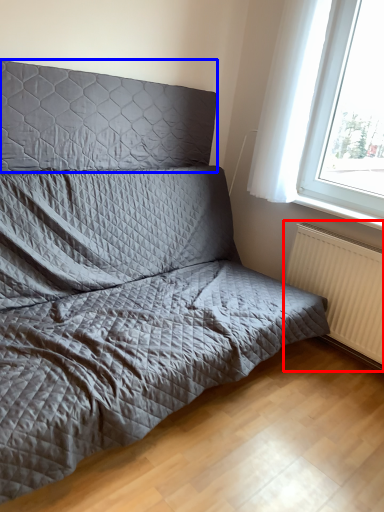
Question: Which object appears closest to the camera in this image, radiator (highlighted by a red box) or headboard (highlighted by a blue box)?

Choices:
 (A) radiator
 (B) headboard

Answer: (B)